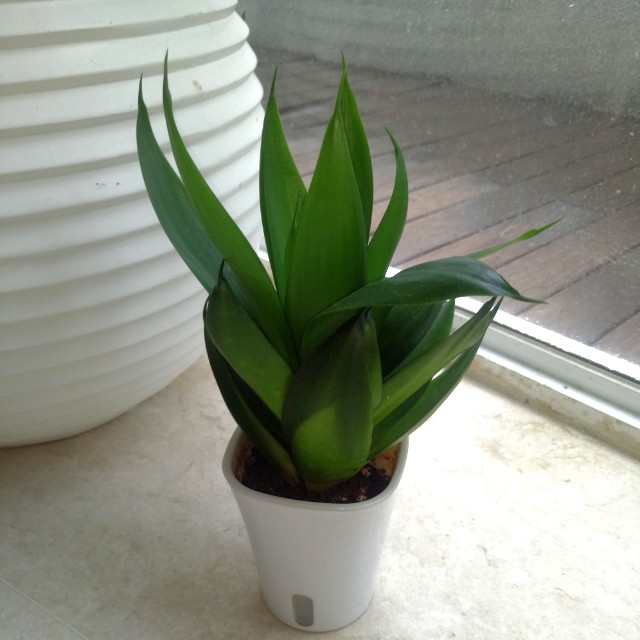
Where is `wood paneling`? This screenshot has width=640, height=640. wood paneling is located at coordinates (585, 246).